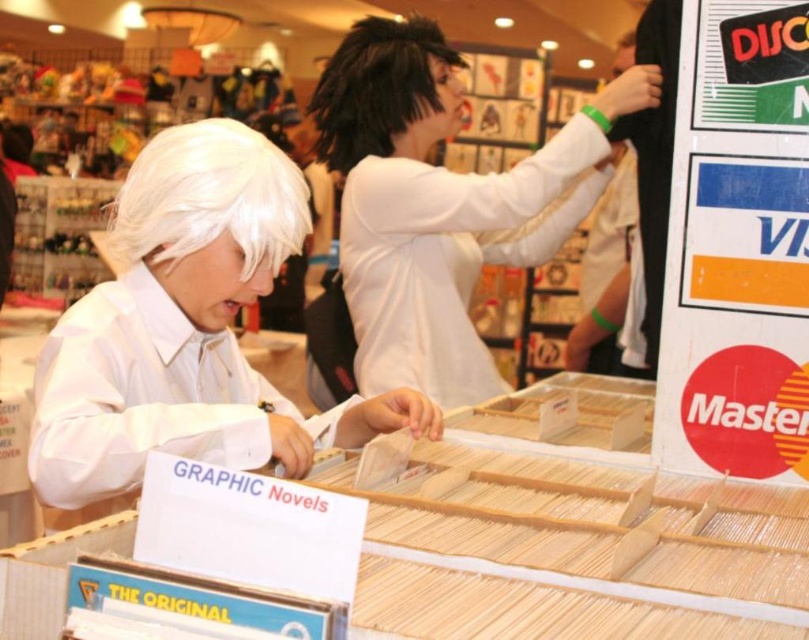
Question: Which of the following is the farthest from the observer?

Choices:
 (A) (417, 28)
 (B) (551, 220)
 (C) (303, 440)

Answer: (B)

Question: Which of the following is the closest to the observer?

Choices:
 (A) (168, 138)
 (B) (147, 140)
 (C) (600, 122)
 (D) (366, 77)

Answer: (A)

Question: Is sleek black wig at upper center behind slick black wig at upper center?

Choices:
 (A) no
 (B) yes

Answer: (A)

Question: Is white matte wig at center wider than slick black wig at upper center?

Choices:
 (A) yes
 (B) no

Answer: (A)

Question: Is sleek black wig at upper center smaller than white synthetic wig at left?

Choices:
 (A) no
 (B) yes

Answer: (A)

Question: Considering the real-world distances, which object is farthest from the slick black wig at upper center?

Choices:
 (A) white synthetic wig at left
 (B) white matte wig at center

Answer: (B)